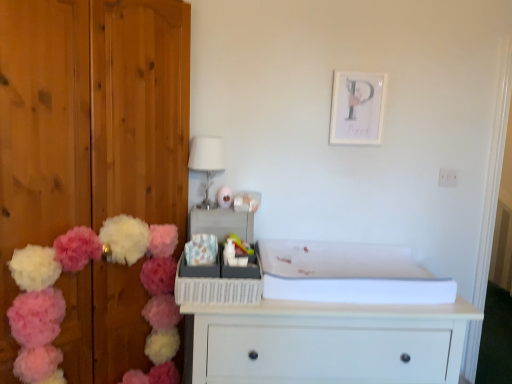
Question: From the image's perspective, is white glossy lampshade at upper center above fluffy yarn pom-poms at left?

Choices:
 (A) no
 (B) yes

Answer: (B)

Question: Is white glossy lampshade at upper center looking in the opposite direction of fluffy yarn pom-poms at left?

Choices:
 (A) no
 (B) yes

Answer: (A)

Question: From a real-world perspective, is white glossy lampshade at upper center on top of fluffy yarn pom-poms at left?

Choices:
 (A) no
 (B) yes

Answer: (B)

Question: Considering the relative positions of white glossy lampshade at upper center and fluffy yarn pom-poms at left in the image provided, is white glossy lampshade at upper center to the left of fluffy yarn pom-poms at left from the viewer's perspective?

Choices:
 (A) yes
 (B) no

Answer: (B)

Question: Considering the relative positions of white glossy lampshade at upper center and fluffy yarn pom-poms at left in the image provided, is white glossy lampshade at upper center to the right of fluffy yarn pom-poms at left from the viewer's perspective?

Choices:
 (A) no
 (B) yes

Answer: (B)

Question: Is white glossy lampshade at upper center not inside fluffy yarn pom-poms at left?

Choices:
 (A) yes
 (B) no

Answer: (A)

Question: From a real-world perspective, does white matte picture frame at upper center stand above matte plastic toy at center?

Choices:
 (A) no
 (B) yes

Answer: (B)

Question: Is white matte picture frame at upper center smaller than matte plastic toy at center?

Choices:
 (A) no
 (B) yes

Answer: (A)

Question: Is white matte picture frame at upper center closer to the viewer compared to matte plastic toy at center?

Choices:
 (A) yes
 (B) no

Answer: (B)

Question: Is the depth of white matte picture frame at upper center greater than that of matte plastic toy at center?

Choices:
 (A) yes
 (B) no

Answer: (A)

Question: Is white matte picture frame at upper center wider than matte plastic toy at center?

Choices:
 (A) no
 (B) yes

Answer: (A)

Question: Can you confirm if white matte picture frame at upper center is positioned to the right of matte plastic toy at center?

Choices:
 (A) yes
 (B) no

Answer: (A)

Question: Does fluffy fabric flower at center turn towards fluffy yarn pom-poms at left?

Choices:
 (A) no
 (B) yes

Answer: (A)